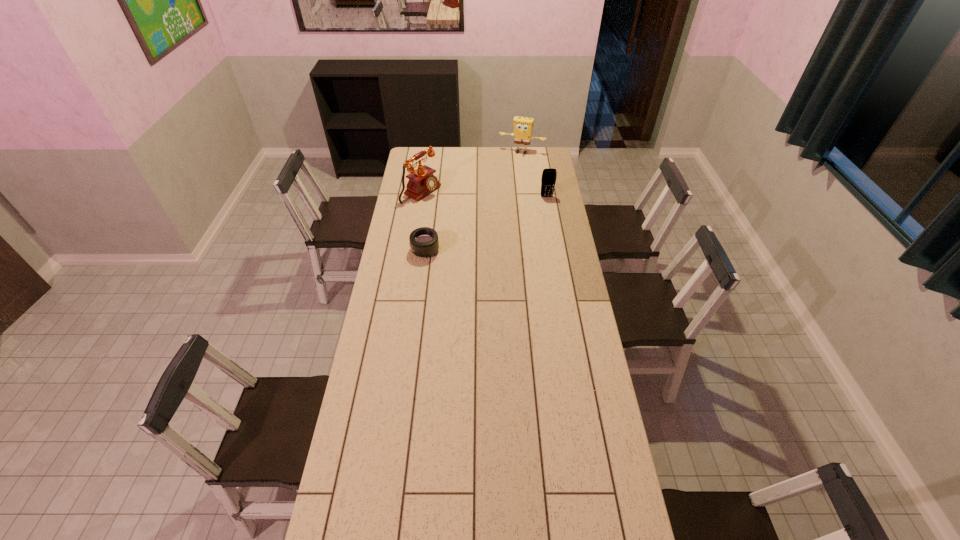
The image size is (960, 540). In order to click on vacant space on the desktop that is between the shortest object and the cellular telephone and is positioned on the face of the farthest object in this screenshot , I will do `click(496, 219)`.

This screenshot has height=540, width=960. I want to click on vacant spot on the desktop that is between the shortest object and the cellular telephone and is positioned on the dial of the telephone, so click(x=484, y=224).